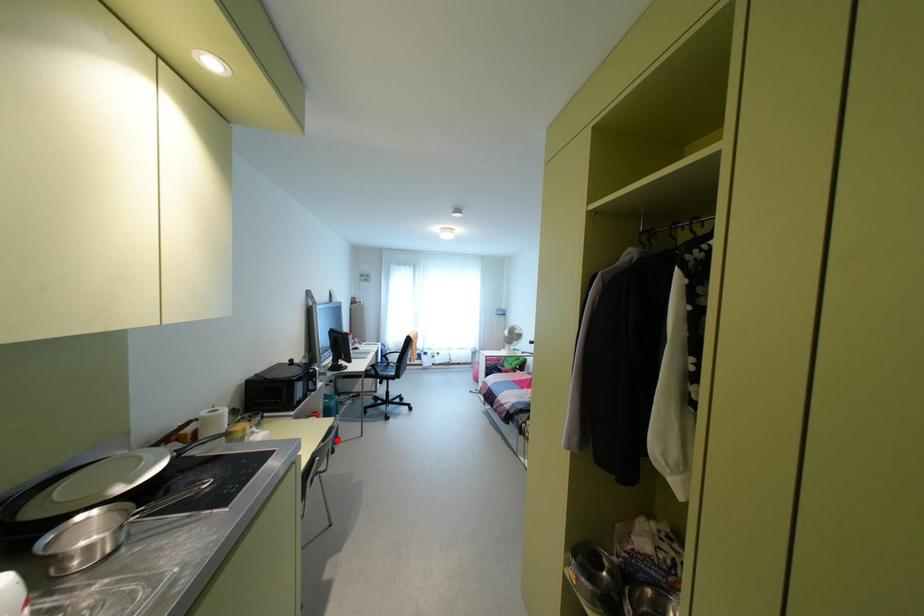
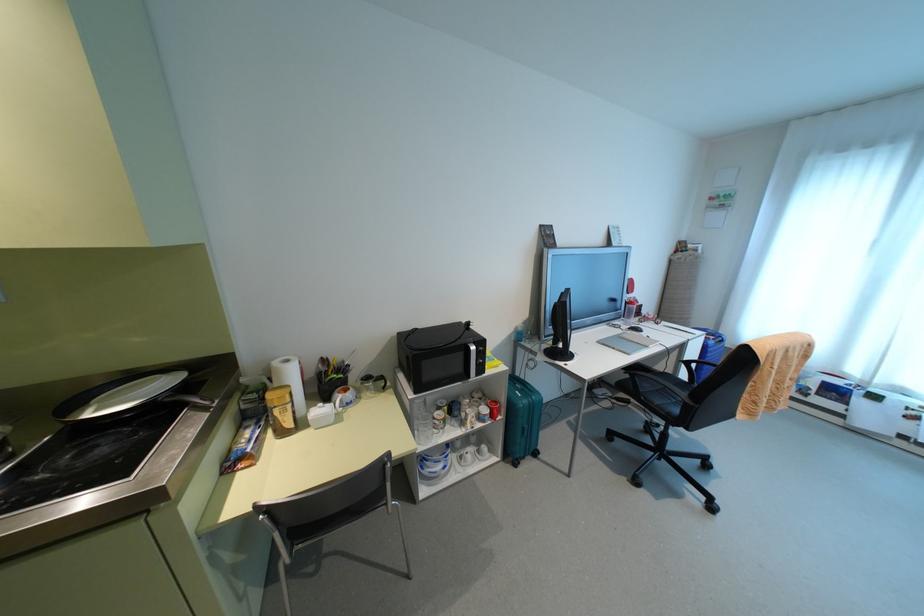
Question: I am providing you with two images of the same scene from different viewpoints. Image1 has a red point marked. In image2, the corresponding 3D location appears at what relative position? Reply with the corresponding letter.

Choices:
 (A) Closer
 (B) Farther

Answer: (B)